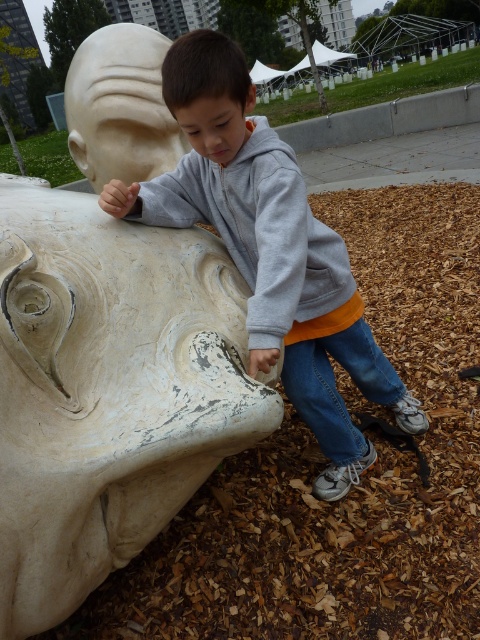
You are a fashion designer analyzing clothing items in the park. You notice the gray matte hoodie at center and the gray fleece sweatshirt at upper center. Which clothing item is wider?

The gray matte hoodie at center is wider than the gray fleece sweatshirt at upper center according to their widths.

In the scene shown: You are standing at the point with coordinates point (188, 35) and want to walk to the point with coordinates point (277, 253). Which direction should you move to reach your destination?

You should move forward because point (277, 253) is in front of point (188, 35).

You are a photographer trying to capture the boy in the scene. You want to focus on the gray matte hoodie at center and the gray fleece sweatshirt at upper center. Which of these two items is positioned closer to the camera?

The gray matte hoodie at center is closer to the viewer than the gray fleece sweatshirt at upper center, so the gray matte hoodie at center would appear larger in the photo.